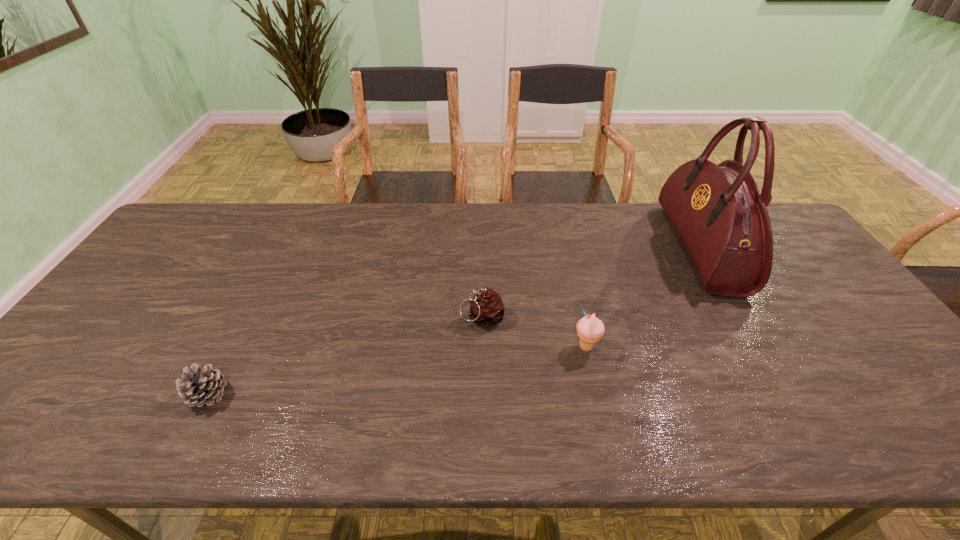
Identify the location of vacant region located 0.370m on the front-facing side of the tallest object. (557, 248).

You are a GUI agent. You are given a task and a screenshot of the screen. Output one action in this format:
    pyautogui.click(x=<x>, y=<y>)
    Task: Click on the free space located on the front of the second nearest object
    
    Given the screenshot: What is the action you would take?
    click(595, 390)

Identify the location of vacant position located 0.390m with a leaf charm attached to the third object from right to left. This screenshot has height=540, width=960. click(x=315, y=318).

The width and height of the screenshot is (960, 540). I want to click on vacant region located with a leaf charm attached to the third object from right to left, so click(x=360, y=318).

I want to click on vacant area situated 0.200m with a leaf charm attached to the third object from right to left, so click(x=386, y=318).

Identify the location of free space located on the left of the nearest object. (84, 394).

Find the location of a particular element. Image resolution: width=960 pixels, height=540 pixels. object that is at the far edge is located at coordinates (718, 212).

Identify the location of object positioned at the near edge. (199, 386).

Locate an element on the screen. The width and height of the screenshot is (960, 540). free space at the far edge of the desktop is located at coordinates (390, 222).

Where is `free space at the near edge of the desktop`? This screenshot has height=540, width=960. free space at the near edge of the desktop is located at coordinates (888, 440).